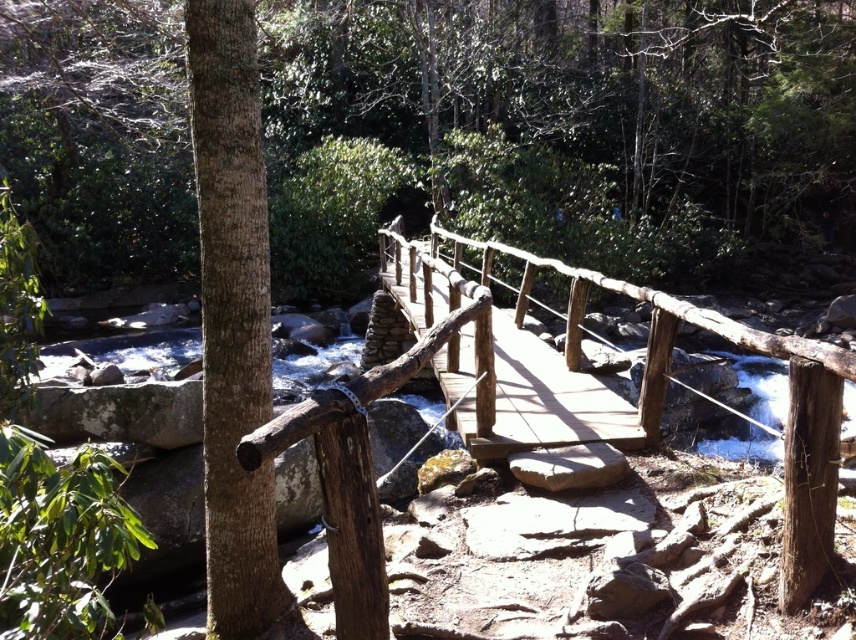
You are a hiker standing on the rustic wooden bridge. You notice a smooth brown tree trunk at left and a brown rough wooden post at lower right. Which object is taller?

The smooth brown tree trunk at left is much taller than the brown rough wooden post at lower right.